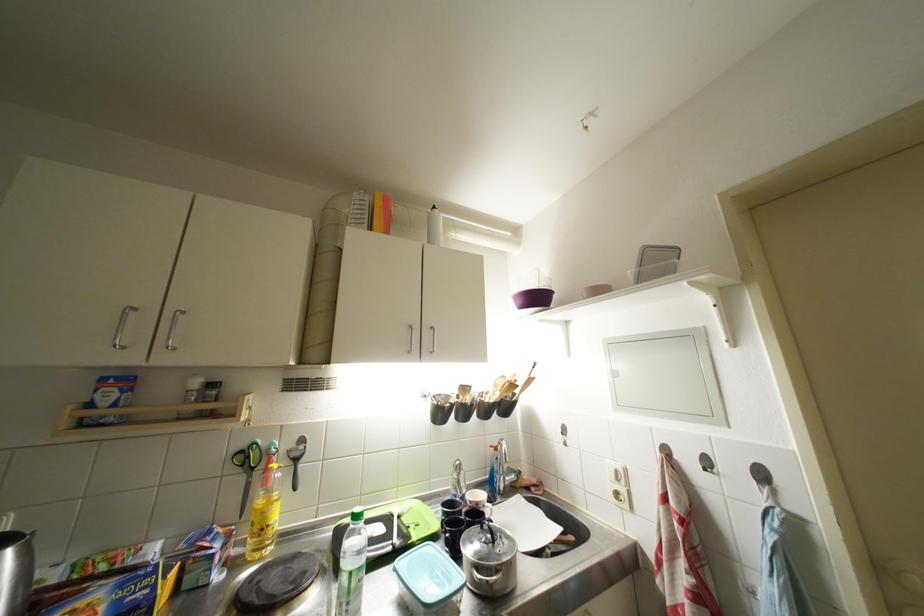
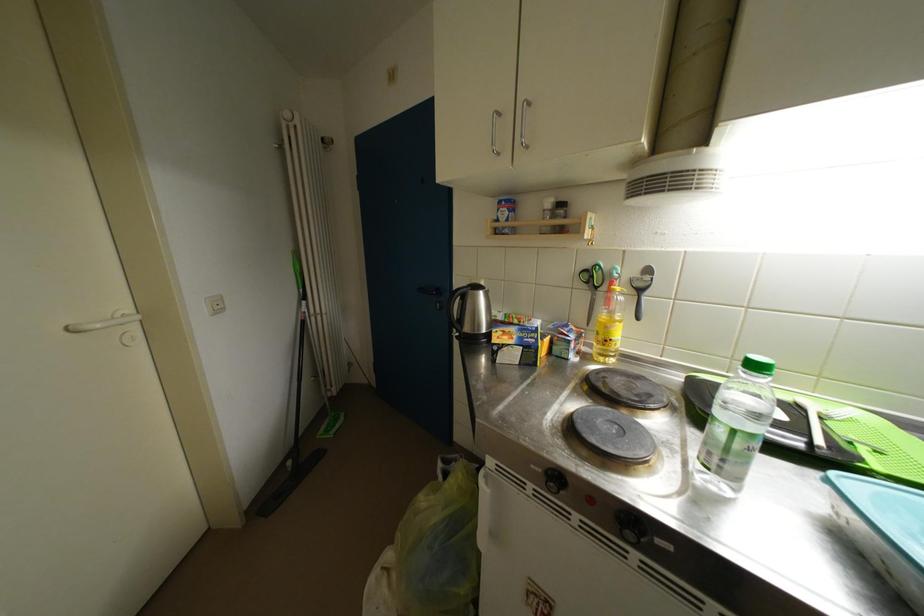
Based on the continuous images, in which direction is the camera rotating?

The camera rotated toward left-down.